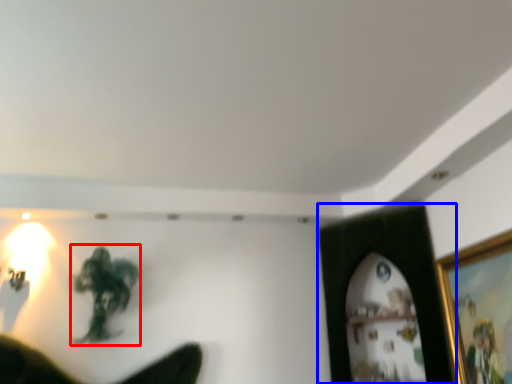
Question: Which object appears closest to the camera in this image, person (highlighted by a red box) or picture frame (highlighted by a blue box)?

Choices:
 (A) person
 (B) picture frame

Answer: (B)